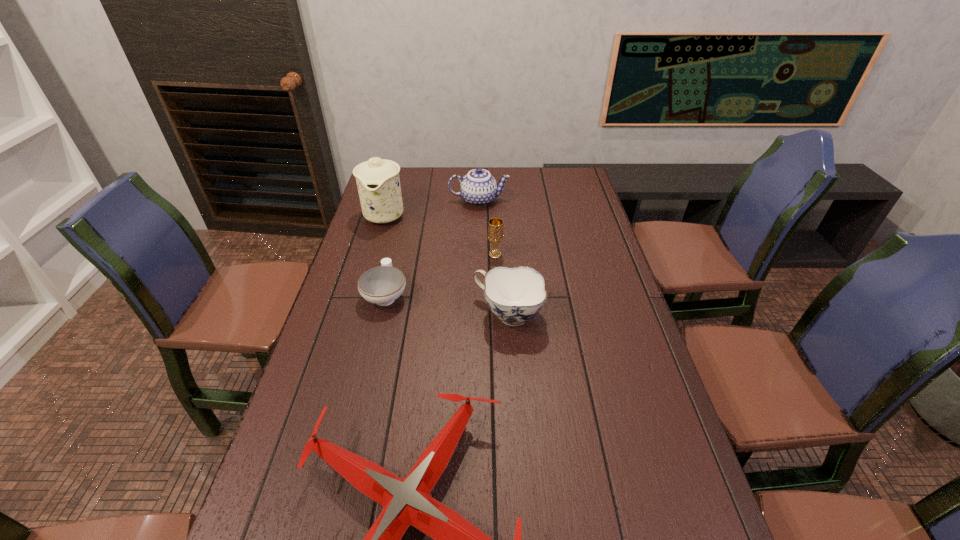
The height and width of the screenshot is (540, 960). In the image, there is a desktop. In order to click on blank space at the left edge in this screenshot , I will do `click(333, 411)`.

In the image, there is a desktop. Where is `free space at the right edge`? This screenshot has width=960, height=540. free space at the right edge is located at coordinates (601, 245).

Locate an element on the screen. This screenshot has height=540, width=960. free spot between the shortest chinaware and the chalice is located at coordinates (441, 275).

Where is `object that is the third nearest to the shortest chinaware`? Image resolution: width=960 pixels, height=540 pixels. object that is the third nearest to the shortest chinaware is located at coordinates pyautogui.click(x=495, y=226).

Identify which object is the third closest to the chalice. Please provide its 2D coordinates. Your answer should be formatted as a tuple, i.e. [(x, y)], where the tuple contains the x and y coordinates of a point satisfying the conditions above.

[(382, 285)]

You are a GUI agent. You are given a task and a screenshot of the screen. Output one action in this format:
    pyautogui.click(x=<x>, y=<y>)
    Task: Click on the chinaware that stands as the closest to the chalice
    
    Given the screenshot: What is the action you would take?
    pyautogui.click(x=515, y=295)

In order to click on chinaware that is the second closest to the shortest chinaware in this screenshot , I will do `click(378, 182)`.

Identify the location of free space that satisfies the following two spatial constraints: 1. on the spout of the third farthest object; 2. on the left side of the tallest chinaware. This screenshot has height=540, width=960. (373, 255).

The height and width of the screenshot is (540, 960). I want to click on vacant space that satisfies the following two spatial constraints: 1. on the spout of the tallest object; 2. on the left side of the third farthest object, so click(373, 255).

At what (x,y) coordinates should I click in order to perform the action: click on free spot that satisfies the following two spatial constraints: 1. on the side with the handle of the shortest object; 2. on the left side of the chalice. Please return your answer as a coordinate pair (x, y). This screenshot has width=960, height=540. Looking at the image, I should click on (396, 255).